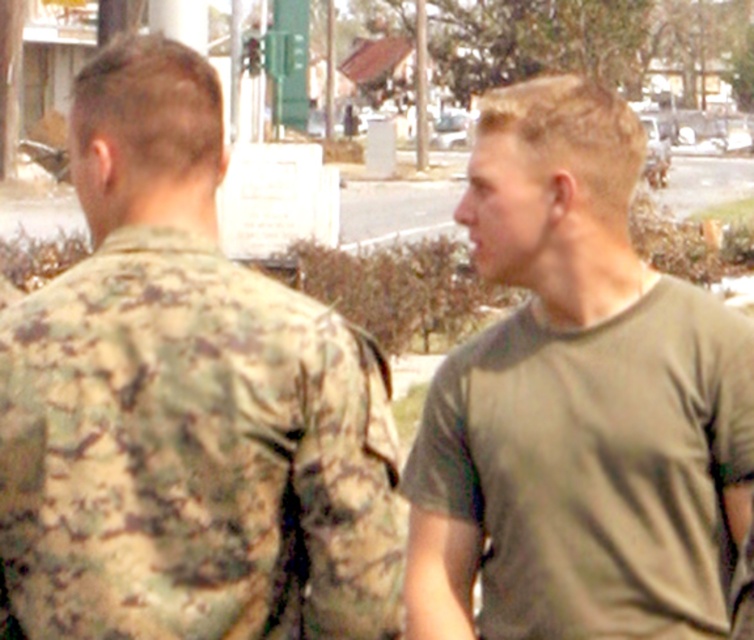
Is camouflage uniform at back shorter than olive green t-shirt at right?

Yes.

Is camouflage uniform at back to the right of olive green t-shirt at right from the viewer's perspective?

No, camouflage uniform at back is not to the right of olive green t-shirt at right.

Which is in front, point (121, 280) or point (605, 138)?

Point (121, 280)

Where is `camouflage uniform at back`? camouflage uniform at back is located at coordinates (185, 404).